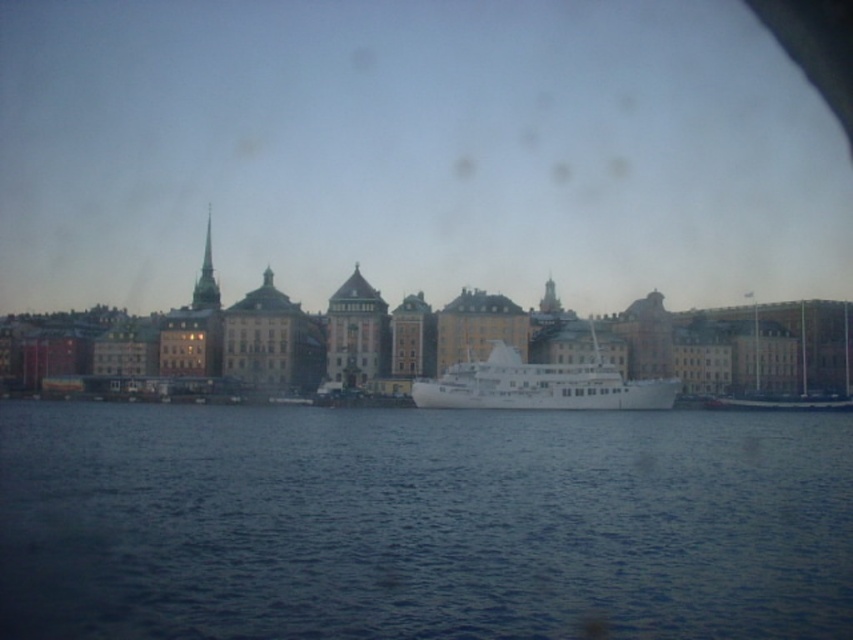
Can you confirm if blue liquid water at center is bigger than white glossy ship at center?

Yes, blue liquid water at center is bigger than white glossy ship at center.

Who is positioned more to the left, blue liquid water at center or white glossy ship at center?

blue liquid water at center is more to the left.

Looking at this image, who is more distant from viewer, (257, 547) or (502, 371)?

Positioned behind is point (502, 371).

Locate an element on the screen. blue liquid water at center is located at coordinates (421, 524).